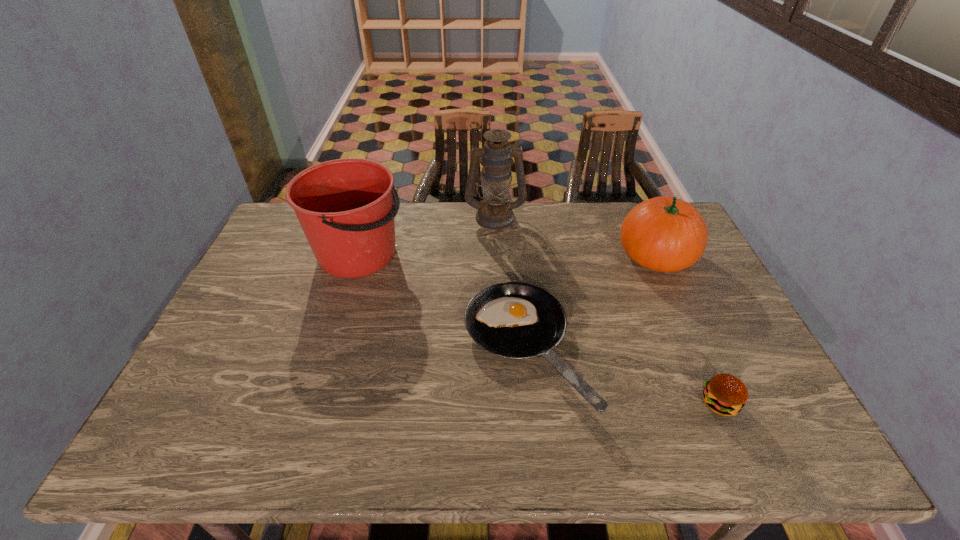
Where is `the fourth closest object to the frying pan`? the fourth closest object to the frying pan is located at coordinates (495, 212).

I want to click on free location that satisfies the following two spatial constraints: 1. on the front side of the leftmost object; 2. on the right side of the frying pan, so click(328, 349).